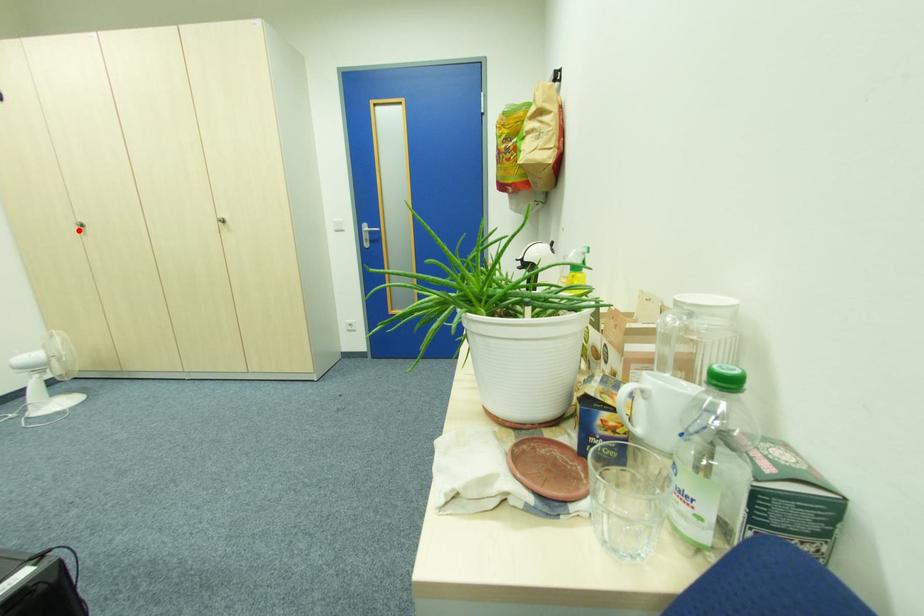
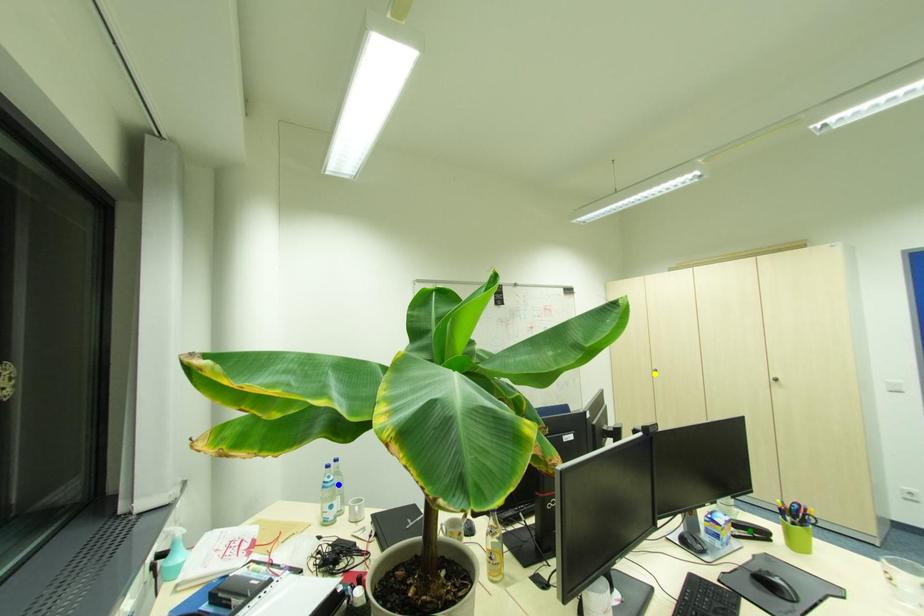
Question: I am providing you with two images of the same scene from different viewpoints. A red point is marked on the first image. You are given multiple points on the second image. Which point in image 2 represents the same 3d spot as the red point in image 1?

Choices:
 (A) blue point
 (B) yellow point
 (C) green point

Answer: (B)